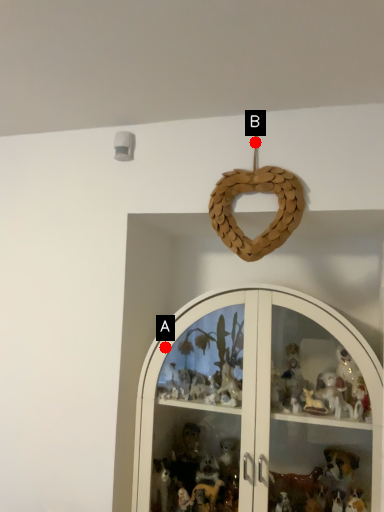
Question: Two points are circled on the image, labeled by A and B beside each circle. Which point appears farthest from the camera in this image?

Choices:
 (A) A is further
 (B) B is further

Answer: (A)